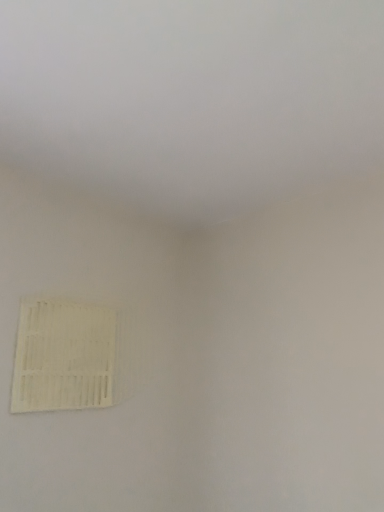
What do you see at coordinates (63, 356) in the screenshot? I see `white textured vent at lower left` at bounding box center [63, 356].

The image size is (384, 512). Find the location of `white textured vent at lower left`. white textured vent at lower left is located at coordinates (63, 356).

Identify the location of white textured vent at lower left. (63, 356).